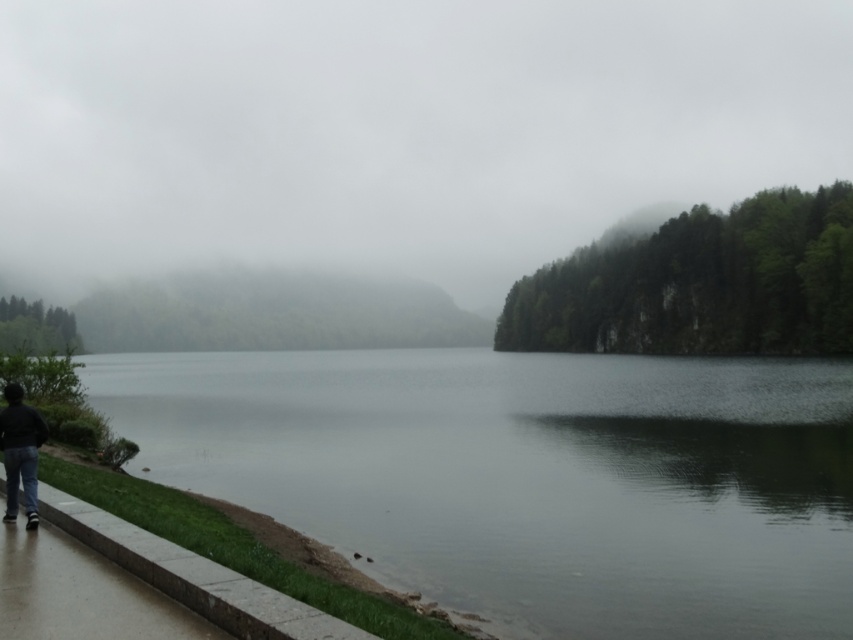
Question: Is smooth gray water at center bigger than dark blue jeans at lower left?

Choices:
 (A) yes
 (B) no

Answer: (A)

Question: Is smooth gray water at center to the right of dark blue jeans at lower left from the viewer's perspective?

Choices:
 (A) no
 (B) yes

Answer: (A)

Question: Can you confirm if smooth gray water at center is positioned below dark blue jeans at lower left?

Choices:
 (A) yes
 (B) no

Answer: (A)

Question: Which point is closer to the camera?

Choices:
 (A) (35, 518)
 (B) (486, 451)

Answer: (A)

Question: Which of the following is the farthest from the observer?

Choices:
 (A) dark blue jeans at lower left
 (B) smooth gray water at center

Answer: (B)